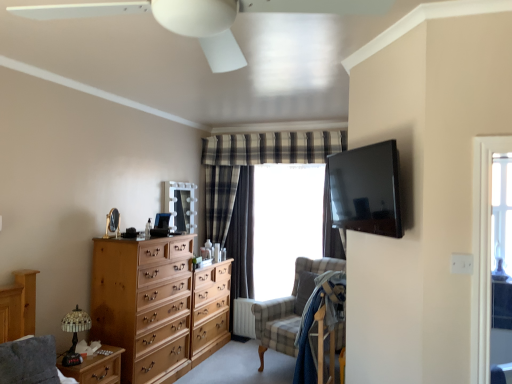
Question: Is white plastic ceiling fan at upper center located within checkered fabric swivel chair at center?

Choices:
 (A) no
 (B) yes

Answer: (A)

Question: Is checkered fabric swivel chair at center oriented towards white plastic ceiling fan at upper center?

Choices:
 (A) no
 (B) yes

Answer: (A)

Question: Is checkered fabric swivel chair at center facing away from white plastic ceiling fan at upper center?

Choices:
 (A) no
 (B) yes

Answer: (A)

Question: Does checkered fabric swivel chair at center have a lesser height compared to white plastic ceiling fan at upper center?

Choices:
 (A) no
 (B) yes

Answer: (A)

Question: From a real-world perspective, is checkered fabric swivel chair at center located beneath white plastic ceiling fan at upper center?

Choices:
 (A) yes
 (B) no

Answer: (A)

Question: From the image's perspective, is white textured radiator at lower center located above or below matte black tv at upper right?

Choices:
 (A) below
 (B) above

Answer: (A)

Question: From a real-world perspective, is white textured radiator at lower center physically located above or below matte black tv at upper right?

Choices:
 (A) below
 (B) above

Answer: (A)

Question: Based on their sizes in the image, would you say white textured radiator at lower center is bigger or smaller than matte black tv at upper right?

Choices:
 (A) big
 (B) small

Answer: (B)

Question: Do you think white textured radiator at lower center is within matte black tv at upper right, or outside of it?

Choices:
 (A) inside
 (B) outside

Answer: (B)

Question: From a real-world perspective, is wooden nightstand at lower left positioned above or below light brown wooden chest of drawers at left?

Choices:
 (A) below
 (B) above

Answer: (A)

Question: Is wooden nightstand at lower left to the left or to the right of light brown wooden chest of drawers at left in the image?

Choices:
 (A) left
 (B) right

Answer: (A)

Question: Is point (100, 379) closer or farther from the camera than point (131, 243)?

Choices:
 (A) farther
 (B) closer

Answer: (B)

Question: Looking at the image, does wooden nightstand at lower left seem bigger or smaller compared to light brown wooden chest of drawers at left?

Choices:
 (A) small
 (B) big

Answer: (A)

Question: In the image, is white plastic ceiling fan at upper center positioned in front of or behind white textured radiator at lower center?

Choices:
 (A) behind
 (B) front

Answer: (B)

Question: From the image's perspective, is white plastic ceiling fan at upper center above or below white textured radiator at lower center?

Choices:
 (A) below
 (B) above

Answer: (B)